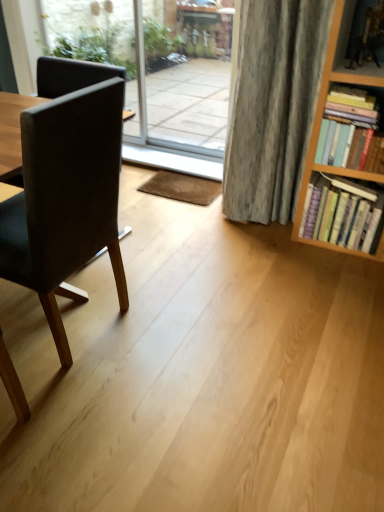
In order to click on free region under matte black chair at left (from a real-world perspective) in this screenshot , I will do `click(72, 324)`.